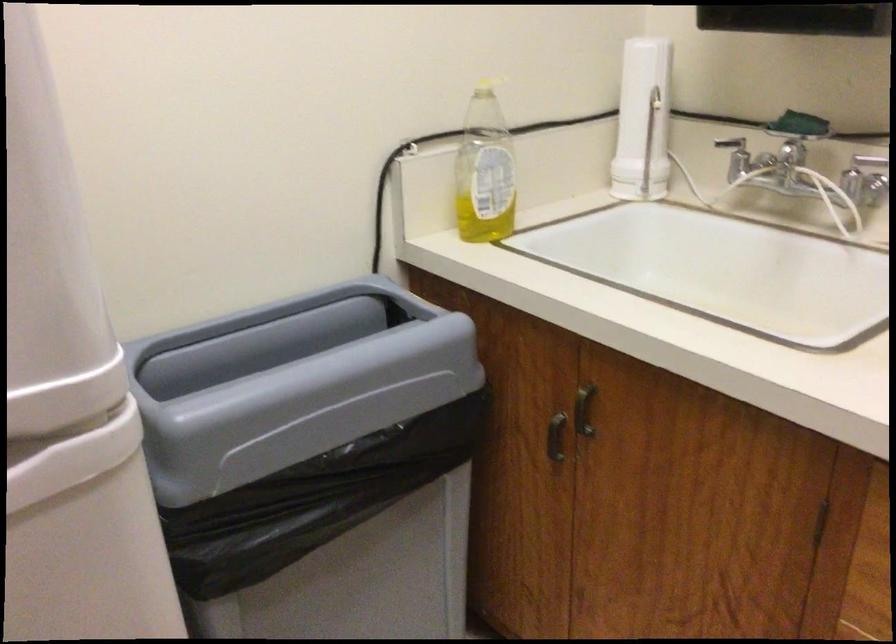
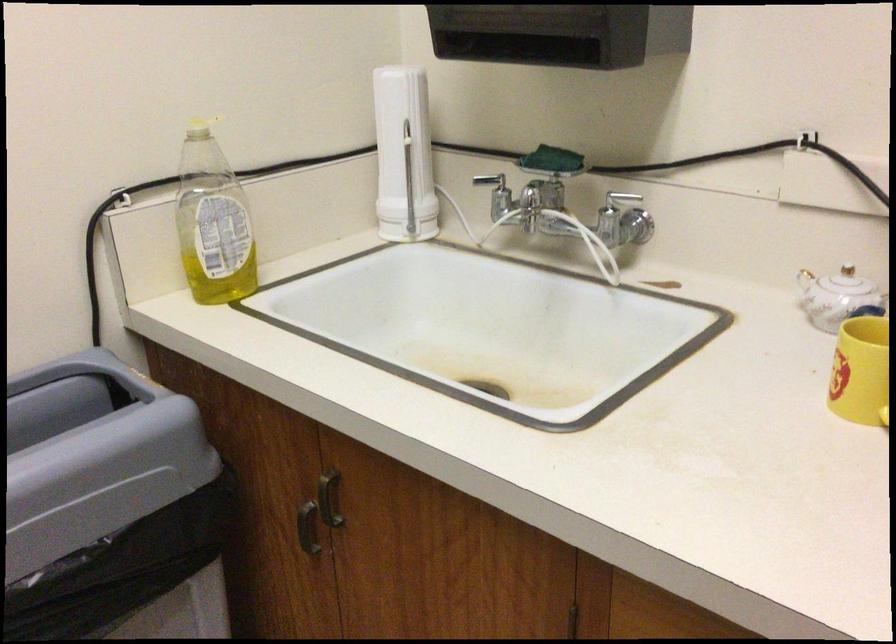
Find the pixel in the second image that matches [472,86] in the first image.

(200, 128)